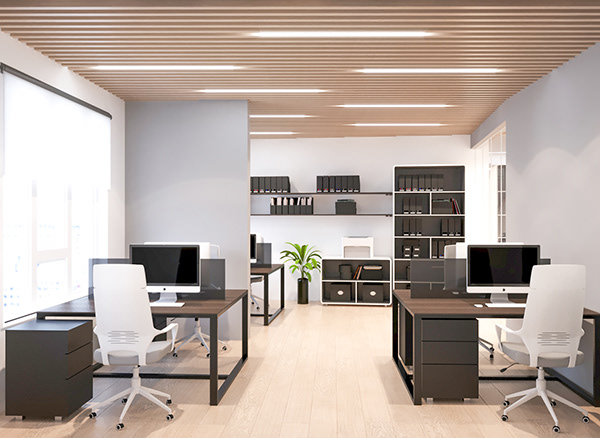
In order to click on shelf in this screenshot , I will do `click(441, 192)`, `click(438, 215)`, `click(419, 237)`, `click(400, 260)`, `click(403, 281)`, `click(381, 280)`, `click(375, 214)`, `click(381, 192)`.